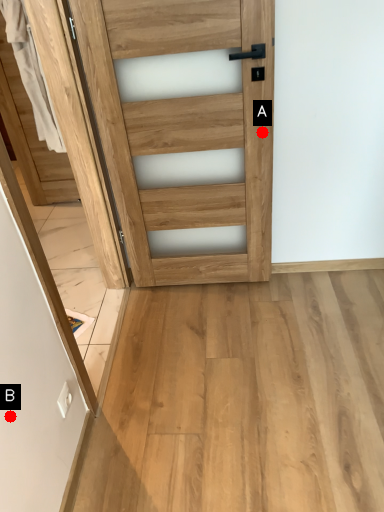
Question: Two points are circled on the image, labeled by A and B beside each circle. Among these points, which one is nearest to the camera?

Choices:
 (A) A is closer
 (B) B is closer

Answer: (B)